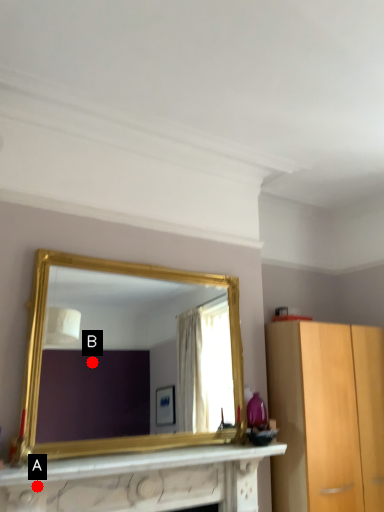
Question: Two points are circled on the image, labeled by A and B beside each circle. Which of the following is the closest to the observer?

Choices:
 (A) A is closer
 (B) B is closer

Answer: (A)